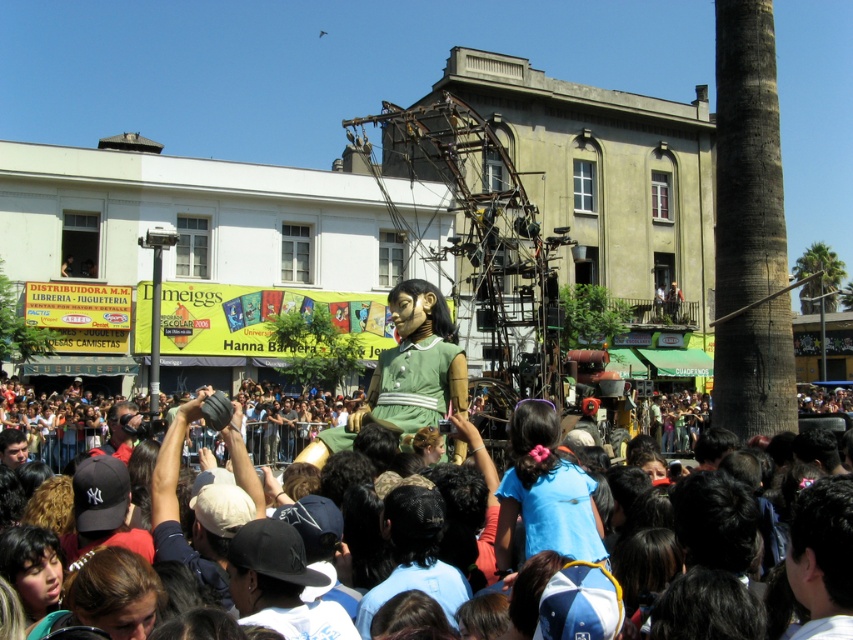
Does green fabric crowd at center appear on the left side of matte black camera at lower left?

No, green fabric crowd at center is not to the left of matte black camera at lower left.

Who is higher up, green fabric crowd at center or matte black camera at lower left?

Positioned higher is matte black camera at lower left.

Locate an element on the screen. green fabric crowd at center is located at coordinates (770, 490).

The image size is (853, 640). I want to click on green fabric crowd at center, so click(770, 490).